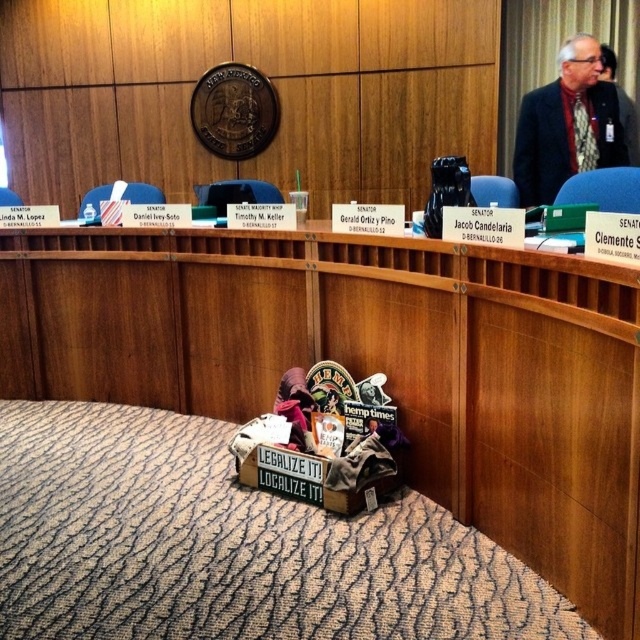
Question: Does wooden box at center have a greater width compared to gray fabric jacket at upper right?

Choices:
 (A) no
 (B) yes

Answer: (B)

Question: Estimate the real-world distances between objects in this image. Which object is closer to the black fabric jacket at upper right?

Choices:
 (A) wooden box at center
 (B) gray fabric jacket at upper right

Answer: (B)

Question: Can you confirm if gray fabric jacket at upper right is positioned above black fabric jacket at upper right?

Choices:
 (A) yes
 (B) no

Answer: (B)

Question: Which point is farther from the camera taking this photo?

Choices:
 (A) (566, 157)
 (B) (509, 464)
 (C) (636, 156)

Answer: (C)

Question: Which of the following is the farthest from the observer?

Choices:
 (A) (634, 163)
 (B) (529, 189)

Answer: (A)

Question: Does wooden box at center have a smaller size compared to gray fabric jacket at upper right?

Choices:
 (A) yes
 (B) no

Answer: (B)